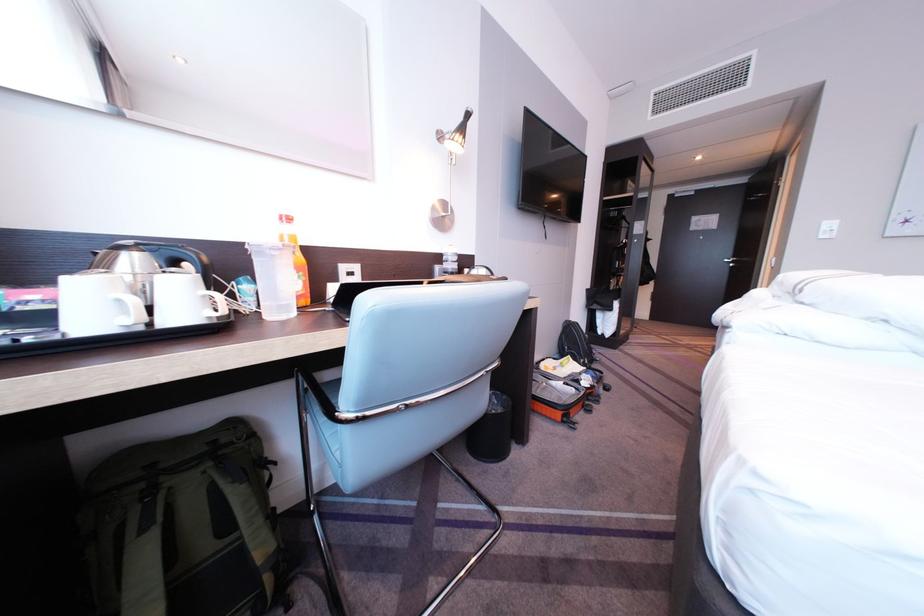
Find where to adjust the lamp head. Please return your answer as a coordinate pair (x, y).

(455, 136)